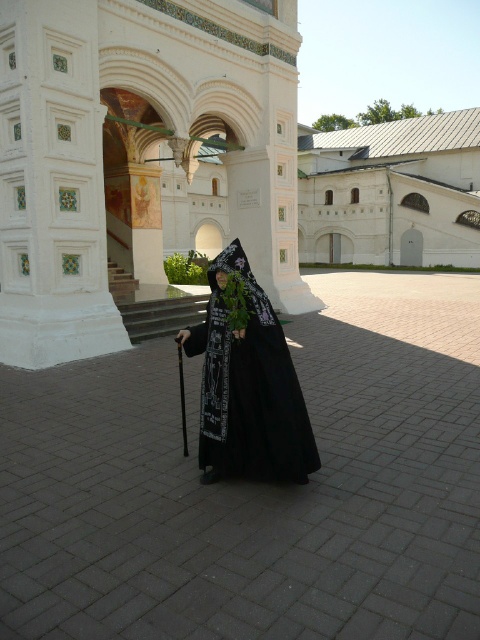
You are an architect visiting the historic site. You need to determine the spatial relationship between the black fabric courtyard at center and the white smooth building at center. Which one has a larger area?

The white smooth building at center has a larger area than the black fabric courtyard at center.

You are an architect analyzing the spatial layout of the scene. The coordinates given are part of a grid system where the bottom left corner is the origin. Based on the provided coordinates, which object in the scene is located at point (392, 193)?

The point (392, 193) corresponds to the white smooth building at center.